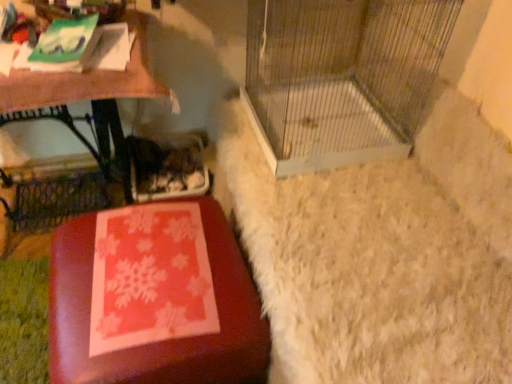
Question: Does wooden table at left lie in front of matte red ottoman at lower left?

Choices:
 (A) yes
 (B) no

Answer: (B)

Question: Is the position of wooden table at left more distant than that of matte red ottoman at lower left?

Choices:
 (A) no
 (B) yes

Answer: (B)

Question: From the image's perspective, is wooden table at left beneath matte red ottoman at lower left?

Choices:
 (A) yes
 (B) no

Answer: (B)

Question: From a real-world perspective, is wooden table at left under matte red ottoman at lower left?

Choices:
 (A) no
 (B) yes

Answer: (A)

Question: Can you confirm if wooden table at left is wider than matte red ottoman at lower left?

Choices:
 (A) no
 (B) yes

Answer: (A)

Question: Is matte red ottoman at lower left at the back of wooden table at left?

Choices:
 (A) yes
 (B) no

Answer: (B)

Question: Is matte red ottoman at lower left facing towards wooden table at left?

Choices:
 (A) no
 (B) yes

Answer: (A)

Question: From the image's perspective, does matte red ottoman at lower left appear lower than wooden table at left?

Choices:
 (A) yes
 (B) no

Answer: (A)

Question: Is there a large distance between matte red ottoman at lower left and wooden table at left?

Choices:
 (A) yes
 (B) no

Answer: (B)

Question: Is matte red ottoman at lower left wider than wooden table at left?

Choices:
 (A) yes
 (B) no

Answer: (A)

Question: From the image's perspective, is matte red ottoman at lower left over wooden table at left?

Choices:
 (A) yes
 (B) no

Answer: (B)

Question: Does matte red ottoman at lower left have a lesser width compared to wooden table at left?

Choices:
 (A) yes
 (B) no

Answer: (B)

Question: Is matte red ottoman at lower left positioned behind metal wire birdcage at center?

Choices:
 (A) yes
 (B) no

Answer: (B)